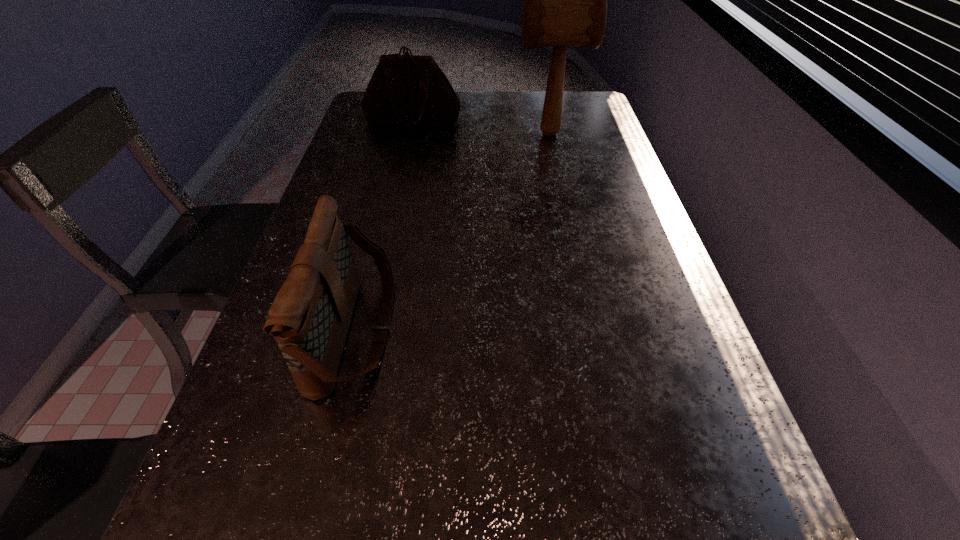
Locate an element on the screen. This screenshot has width=960, height=540. the tallest object is located at coordinates (565, 0).

This screenshot has height=540, width=960. What are the coordinates of `the rightmost object` in the screenshot? It's located at (565, 0).

The height and width of the screenshot is (540, 960). I want to click on the farther shoulder bag, so click(410, 90).

This screenshot has height=540, width=960. I want to click on the nearer shoulder bag, so click(310, 316).

Identify the location of vacant space situated on the strike surface of the rightmost object. (428, 134).

Find the location of `free region located on the strike surface of the rightmost object`. free region located on the strike surface of the rightmost object is located at coordinates (428, 134).

The width and height of the screenshot is (960, 540). Find the location of `free space located on the strike surface of the rightmost object`. free space located on the strike surface of the rightmost object is located at coordinates (400, 134).

You are a GUI agent. You are given a task and a screenshot of the screen. Output one action in this format:
    pyautogui.click(x=<x>, y=<y>)
    Task: Click on the free space located 0.360m on the front of the farther shoulder bag
    The width and height of the screenshot is (960, 540).
    Given the screenshot: What is the action you would take?
    pyautogui.click(x=396, y=197)

The image size is (960, 540). Find the location of `blank area located 0.280m on the front-facing side of the nearer shoulder bag`. blank area located 0.280m on the front-facing side of the nearer shoulder bag is located at coordinates (531, 330).

You are a GUI agent. You are given a task and a screenshot of the screen. Output one action in this format:
    pyautogui.click(x=<x>, y=<y>)
    Task: Click on the object that is at the far edge
    
    Given the screenshot: What is the action you would take?
    pyautogui.click(x=410, y=90)